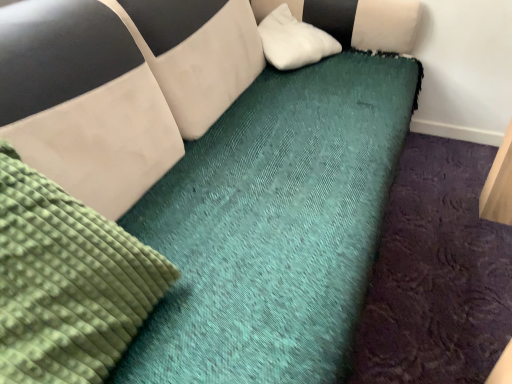
Measure the distance between green textured mattress at upper left and camera.

The depth of green textured mattress at upper left is 23.29 inches.

The width and height of the screenshot is (512, 384). I want to click on green textured mattress at upper left, so click(67, 282).

Describe the element at coordinates (67, 282) in the screenshot. I see `green textured mattress at upper left` at that location.

This screenshot has width=512, height=384. In order to click on white soft pillow at upper center in this screenshot , I will do `click(293, 40)`.

What do you see at coordinates (293, 40) in the screenshot? I see `white soft pillow at upper center` at bounding box center [293, 40].

What is the approximate width of white soft pillow at upper center?

16.29 inches.

The width and height of the screenshot is (512, 384). I want to click on green textured mattress at upper left, so click(67, 282).

Is green textured mattress at upper left to the left or to the right of white soft pillow at upper center in the image?

→ Clearly, green textured mattress at upper left is on the left of white soft pillow at upper center in the image.

In the image, is green textured mattress at upper left positioned in front of or behind white soft pillow at upper center?

Visually, green textured mattress at upper left is located in front of white soft pillow at upper center.

Which is in front, point (94, 380) or point (302, 53)?

The point (94, 380) is closer.

From the image's perspective, is green textured mattress at upper left below white soft pillow at upper center?

Yes, from the image's perspective, green textured mattress at upper left is beneath white soft pillow at upper center.

From a real-world perspective, is green textured mattress at upper left physically above white soft pillow at upper center?

Yes, from a real-world perspective, green textured mattress at upper left is above white soft pillow at upper center.

Does green textured mattress at upper left have a greater width compared to white soft pillow at upper center?

No, green textured mattress at upper left is not wider than white soft pillow at upper center.

Who is shorter, green textured mattress at upper left or white soft pillow at upper center?

white soft pillow at upper center is shorter.

Between green textured mattress at upper left and white soft pillow at upper center, which one has smaller size?

With smaller size is white soft pillow at upper center.

From the picture: Is white soft pillow at upper center surrounded by green textured mattress at upper left?

No, white soft pillow at upper center is located outside of green textured mattress at upper left.

Would you say green textured mattress at upper left is a long distance from white soft pillow at upper center?

green textured mattress at upper left is far away from white soft pillow at upper center.

Is green textured mattress at upper left facing away from white soft pillow at upper center?

No.

How many degrees apart are the facing directions of green textured mattress at upper left and white soft pillow at upper center?

0.000774 degrees.

How much distance is there between green textured mattress at upper left and white soft pillow at upper center?

green textured mattress at upper left and white soft pillow at upper center are 1.24 meters apart from each other.

This screenshot has height=384, width=512. What are the coordinates of `pillow on the right of green textured mattress at upper left` in the screenshot? It's located at (293, 40).

Visually, is white soft pillow at upper center positioned to the left or to the right of green textured mattress at upper left?

In the image, white soft pillow at upper center appears on the right side of green textured mattress at upper left.

Looking at this image, does white soft pillow at upper center lie behind green textured mattress at upper left?

Yes, it is.

Is point (277, 31) farther from viewer compared to point (23, 264)?

Yes.

From the image's perspective, is white soft pillow at upper center above or below green textured mattress at upper left?

From the image's perspective, white soft pillow at upper center appears above green textured mattress at upper left.

From a real-world perspective, is white soft pillow at upper center physically located above or below green textured mattress at upper left?

Clearly, from a real-world perspective, white soft pillow at upper center is below green textured mattress at upper left.

Considering the sizes of objects white soft pillow at upper center and green textured mattress at upper left in the image provided, who is thinner, white soft pillow at upper center or green textured mattress at upper left?

green textured mattress at upper left is thinner.

Can you confirm if white soft pillow at upper center is taller than green textured mattress at upper left?

No.

Is white soft pillow at upper center bigger than green textured mattress at upper left?

No.

Would you say white soft pillow at upper center is outside green textured mattress at upper left?

Yes.

Would you consider white soft pillow at upper center to be distant from green textured mattress at upper left?

white soft pillow at upper center is positioned a significant distance from green textured mattress at upper left.

Is white soft pillow at upper center facing away from green textured mattress at upper left?

white soft pillow at upper center does not have its back to green textured mattress at upper left.

Find the location of a particular element. The image size is (512, 384). pillow below the green textured mattress at upper left (from a real-world perspective) is located at coordinates (293, 40).

Where is `mattress above the white soft pillow at upper center (from a real-world perspective)`? mattress above the white soft pillow at upper center (from a real-world perspective) is located at coordinates [67, 282].

Image resolution: width=512 pixels, height=384 pixels. Find the location of `mattress on the left of white soft pillow at upper center`. mattress on the left of white soft pillow at upper center is located at coordinates (67, 282).